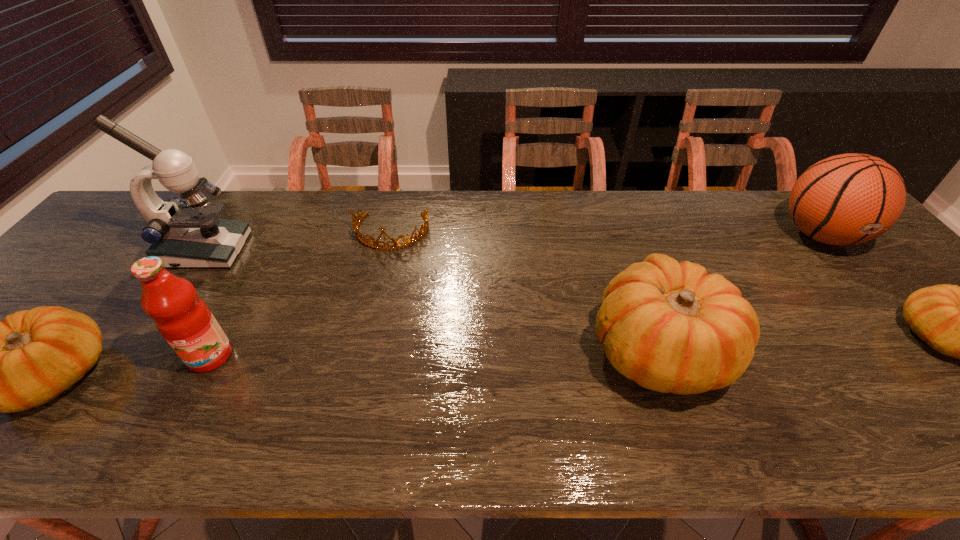
In the image, there is a desktop. Where is `vacant space at the near edge`? vacant space at the near edge is located at coordinates (571, 386).

Find the location of a particular element. vacant space at the left edge is located at coordinates click(x=138, y=245).

The image size is (960, 540). I want to click on free space at the right edge of the desktop, so click(x=913, y=346).

Where is `vacant space that is in between the tallest object and the fourth tallest object`? The height and width of the screenshot is (540, 960). vacant space that is in between the tallest object and the fourth tallest object is located at coordinates (432, 300).

Where is `vacant region between the tiara and the tallest object`? vacant region between the tiara and the tallest object is located at coordinates (x=299, y=241).

Where is `vacant space that is in between the shortest object and the fifth object from right to left`? This screenshot has width=960, height=540. vacant space that is in between the shortest object and the fifth object from right to left is located at coordinates 300,294.

Locate which object ranks sixth in proximity to the third shortest object. Please provide its 2D coordinates. Your answer should be formatted as a tuple, i.e. [(x, y)], where the tuple contains the x and y coordinates of a point satisfying the conditions above.

[(959, 322)]

You are a GUI agent. You are given a task and a screenshot of the screen. Output one action in this format:
    pyautogui.click(x=<x>, y=<y>)
    Task: Click on the object that is the second closest to the fruit juice
    The image size is (960, 540).
    Given the screenshot: What is the action you would take?
    pyautogui.click(x=183, y=234)

The width and height of the screenshot is (960, 540). Identify the location of the second closest gourd to the tallest object. (671, 327).

Find the location of a particular element. This screenshot has height=540, width=960. gourd that is the second closest to the shortest gourd is located at coordinates (28, 359).